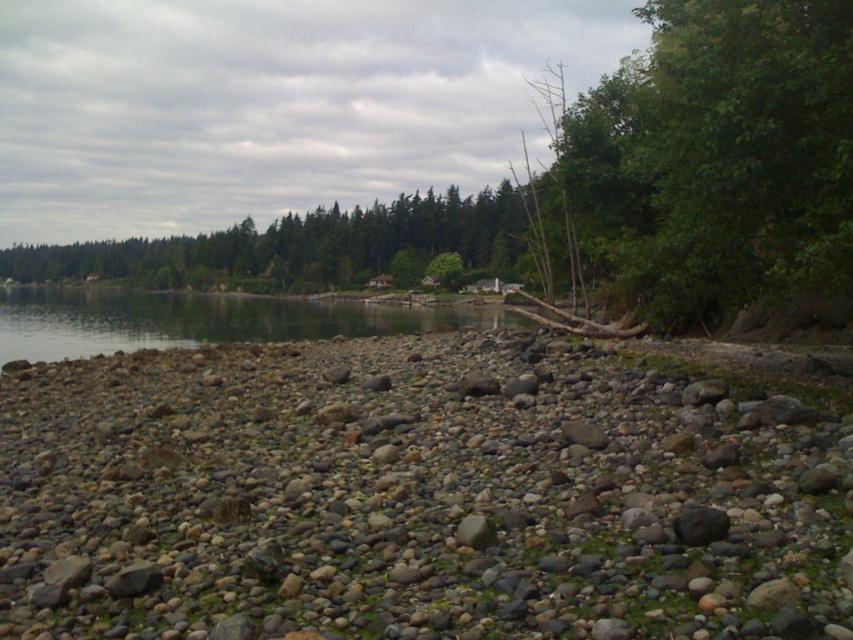
You are standing at the lakeside and want to reach the point marked as point (842, 195). If your walking speed is 1.5 meters per second, how many seconds will it take you to reach that point?

The distance between you and point (842, 195) is 8.02 meters. At a speed of 1.5 meters per second, it would take approximately 5.35 seconds to reach the point.

You are standing at point [413,496] in the lakeside scene. What type of terrain would you expect to find under your feet?

At point [413,496] lies gray rocky pebbles at center, so you would expect to find gray rocky pebbles under your feet.